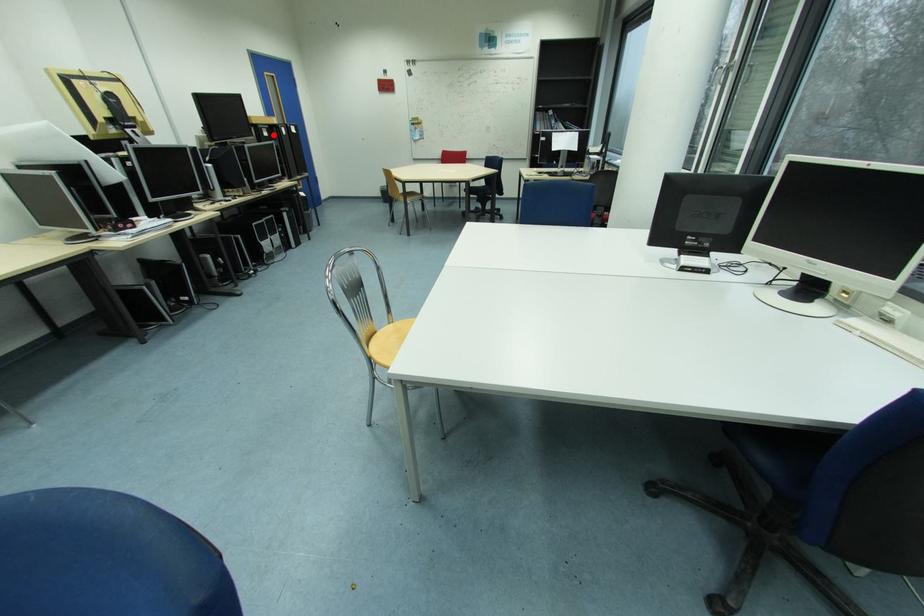
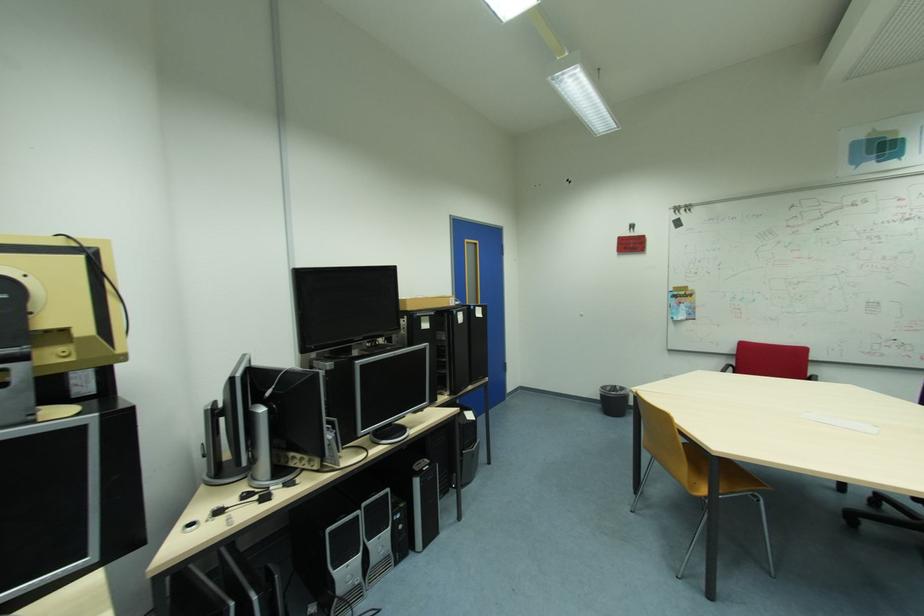
Question: I am providing you with two images of the same scene from different viewpoints. Given a red point in image1, look at the same physical point in image2. Is it:

Choices:
 (A) Closer to the viewpoint
 (B) Farther from the viewpoint

Answer: (B)